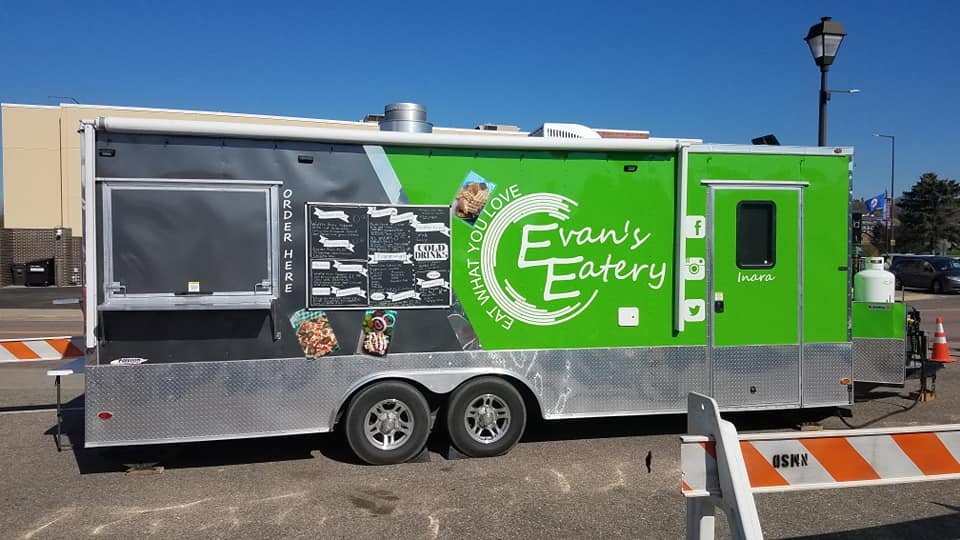
The image size is (960, 540). Find the location of `window`. window is located at coordinates point(180,249).